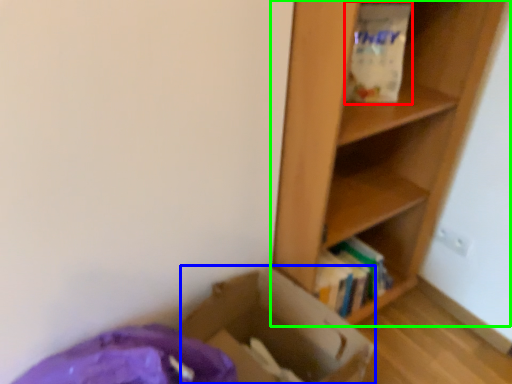
Question: Based on their relative distances, which object is nearer to paper bag (highlighted by a red box)? Choose from cardboard box (highlighted by a blue box) and shelf (highlighted by a green box).

Choices:
 (A) cardboard box
 (B) shelf

Answer: (B)